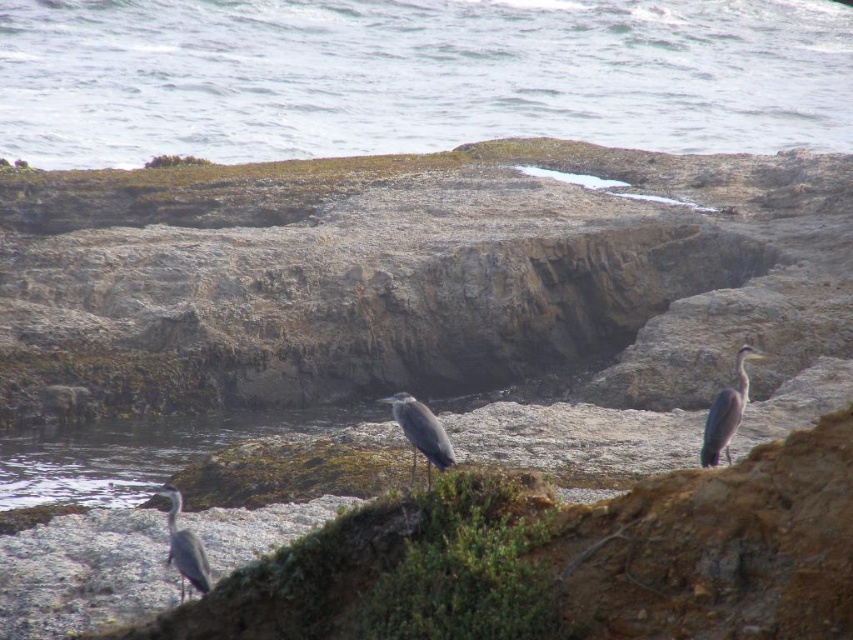
You are a birdwatcher standing on the rocky terrain. You notice the clear water at center. Where exactly is the clear water located in the scene?

The clear water at center is located at point coordinates of 0.120 on the x axis and 0.489 on the y axis.

In the scene shown: You are standing on the rocky terrain in the coastal scene. You see clear water at center at point (416, 76). Is the clear water at center closer to you or farther away from you compared to the rocks you are standing on?

The clear water at center is located at point (416, 76), which is in the center of the image. Since you are standing on the rocks in the foreground, the clear water at center is farther away from you than the rocks you are standing on.

You are standing on the rocky shore and see the clear water at center and the gray matte heron at right. Which object is positioned to the left of the other?

The clear water at center is to the right of the gray matte heron at right, so the gray matte heron at right is positioned to the left of the clear water at center.